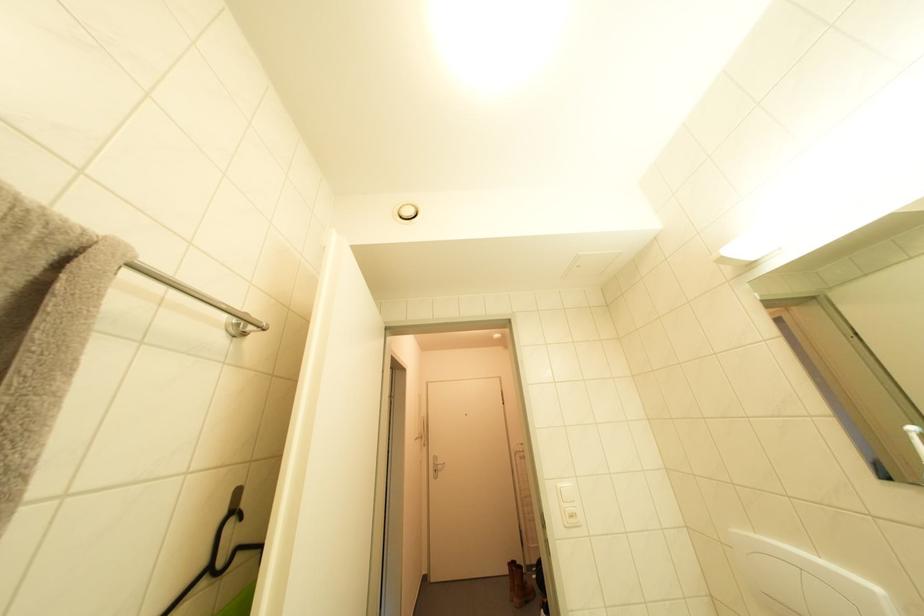
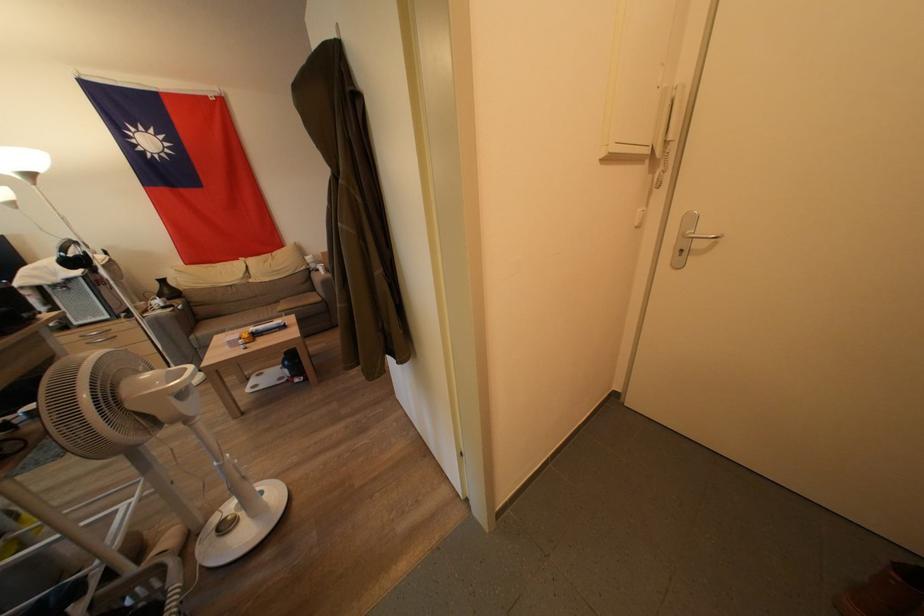
Where in the second image is the point corresponding to the point at 444,466 from the first image?

(710, 233)